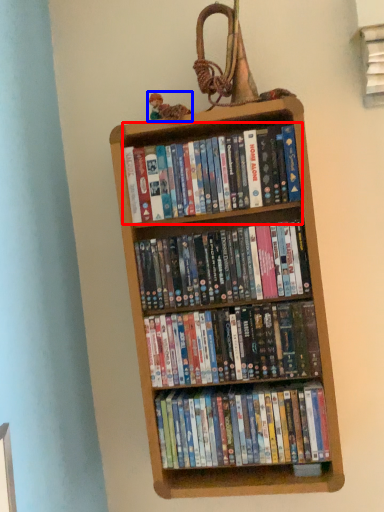
Question: Which of the following is the farthest to the observer, book (highlighted by a red box) or toy (highlighted by a blue box)?

Choices:
 (A) book
 (B) toy

Answer: (B)